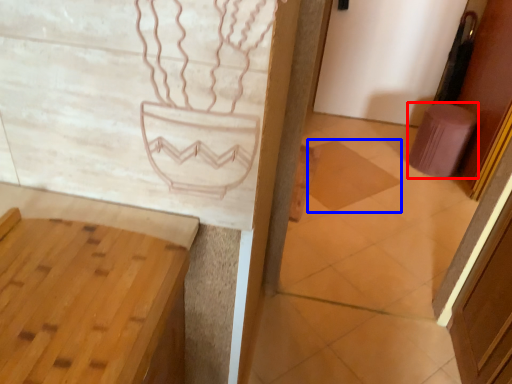
Question: Among these objects, which one is farthest to the camera, stool (highlighted by a red box) or tile (highlighted by a blue box)?

Choices:
 (A) stool
 (B) tile

Answer: (A)